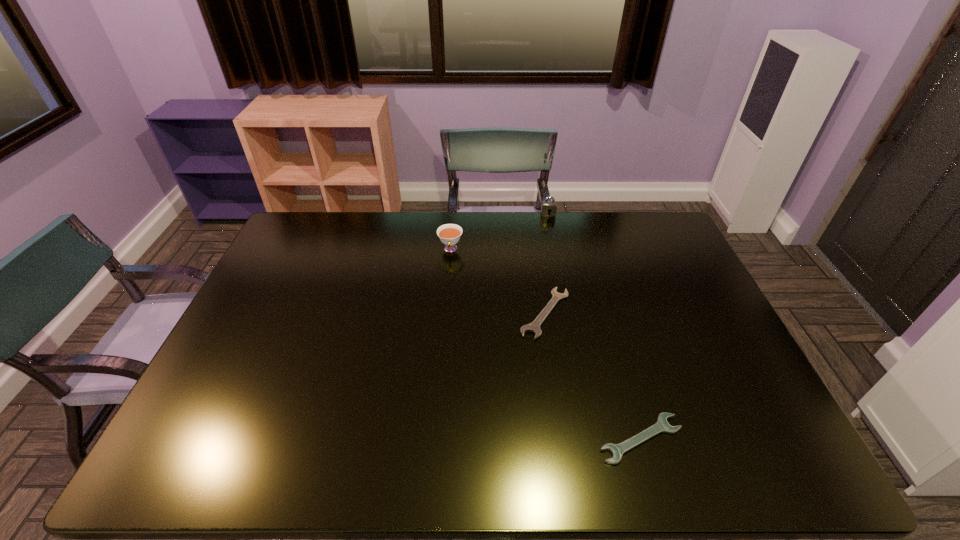
Where is `object that is the second closest to the nearest object`? This screenshot has height=540, width=960. object that is the second closest to the nearest object is located at coordinates (449, 234).

Where is `vacant area that satisfies the following two spatial constraints: 1. at the front of the padlock near the keyhole; 2. on the right side of the nearest object`? vacant area that satisfies the following two spatial constraints: 1. at the front of the padlock near the keyhole; 2. on the right side of the nearest object is located at coordinates (594, 438).

You are a GUI agent. You are given a task and a screenshot of the screen. Output one action in this format:
    pyautogui.click(x=<x>, y=<y>)
    Task: Click on the vacant space that satisfies the following two spatial constraints: 1. on the front side of the nearer wrench; 2. on the left side of the third farthest object
    This screenshot has width=960, height=540.
    Given the screenshot: What is the action you would take?
    pyautogui.click(x=564, y=438)

This screenshot has height=540, width=960. What are the coordinates of `free space that satisfies the following two spatial constraints: 1. on the side of the second nearest object with the handle; 2. on the left side of the third nearest object` in the screenshot? It's located at (445, 313).

This screenshot has height=540, width=960. In order to click on free space that satisfies the following two spatial constraints: 1. on the side of the second nearest object with the handle; 2. on the right side of the leftmost object in this screenshot , I will do `click(445, 313)`.